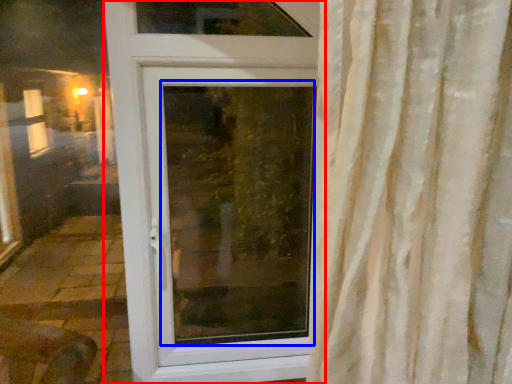
Question: Which object is further to the camera taking this photo, door (highlighted by a red box) or window screen (highlighted by a blue box)?

Choices:
 (A) door
 (B) window screen

Answer: (B)